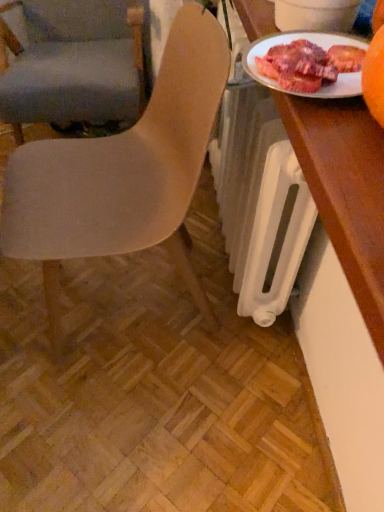
Describe the element at coordinates (123, 173) in the screenshot. I see `matte beige chair at center, which is the first chair in front-to-back order` at that location.

Locate an element on the screen. The width and height of the screenshot is (384, 512). matte beige chair at center, the 2th chair when ordered from back to front is located at coordinates (123, 173).

Describe the element at coordinates (313, 42) in the screenshot. This screenshot has height=512, width=384. I see `white glossy plate at upper right` at that location.

Where is `matte beige chair at center, the 2th chair when ordered from back to front`? The height and width of the screenshot is (512, 384). matte beige chair at center, the 2th chair when ordered from back to front is located at coordinates (123, 173).

Which of these two, matte gray chair at left, the second chair from the front, or wooden desk at right, is wider?

matte gray chair at left, the second chair from the front, is wider.

Is matte gray chair at left, marked as the first chair in a back-to-front arrangement, at the left side of wooden desk at right?

Yes.

The image size is (384, 512). What are the coordinates of `chair that is the 2nd one when counting leftward from the wooden desk at right` in the screenshot? It's located at pos(74,63).

Could you tell me if matte gray chair at left, marked as the first chair in a back-to-front arrangement, is facing wooden desk at right?

Yes, matte gray chair at left, marked as the first chair in a back-to-front arrangement, is turned towards wooden desk at right.

In order to click on chair below the matte gray chair at left, the second chair from the front (from the image's perspective) in this screenshot , I will do `click(123, 173)`.

Between matte gray chair at left, the second chair from the front, and matte beige chair at center, the 2th chair when ordered from back to front, which one has larger width?

matte gray chair at left, the second chair from the front, is wider.

Which of these two, matte gray chair at left, marked as the first chair in a back-to-front arrangement, or matte beige chair at center, which is the first chair in front-to-back order, stands taller?

matte beige chair at center, which is the first chair in front-to-back order.

From a real-world perspective, is matte gray chair at left, the second chair from the front, positioned under matte beige chair at center, the 2th chair when ordered from back to front, based on gravity?

Yes.

Is matte gray chair at left, the second chair from the front, completely or partially outside of white glossy plate at upper right?

matte gray chair at left, the second chair from the front, is positioned outside white glossy plate at upper right.

How different are the orientations of matte gray chair at left, the second chair from the front, and white glossy plate at upper right in degrees?

The angle between the facing direction of matte gray chair at left, the second chair from the front, and the facing direction of white glossy plate at upper right is 90.3 degrees.

Which is more distant, (141, 42) or (331, 87)?

Point (141, 42)

Is matte gray chair at left, the second chair from the front, facing away from white glossy plate at upper right?

No, matte gray chair at left, the second chair from the front, is not facing the opposite direction of white glossy plate at upper right.

Considering the positions of point (338, 93) and point (51, 55), is point (338, 93) closer or farther from the camera than point (51, 55)?

Point (338, 93) is closer to the camera than point (51, 55).

Who is bigger, white glossy plate at upper right or matte gray chair at left, the second chair from the front?

With larger size is matte gray chair at left, the second chair from the front.

Is the depth of white glossy plate at upper right less than that of matte gray chair at left, the second chair from the front?

Yes, the depth of white glossy plate at upper right is less than that of matte gray chair at left, the second chair from the front.

Is white glossy plate at upper right not within matte gray chair at left, the second chair from the front?

white glossy plate at upper right is positioned outside matte gray chair at left, the second chair from the front.

From a real-world perspective, is matte beige chair at center, the 2th chair when ordered from back to front, beneath wooden desk at right?

Yes, from a real-world perspective, matte beige chair at center, the 2th chair when ordered from back to front, is beneath wooden desk at right.

Does matte beige chair at center, the 2th chair when ordered from back to front, come in front of wooden desk at right?

No, the depth of matte beige chair at center, the 2th chair when ordered from back to front, is greater than that of wooden desk at right.

Who is bigger, matte beige chair at center, the 2th chair when ordered from back to front, or wooden desk at right?

Bigger between the two is matte beige chair at center, the 2th chair when ordered from back to front.

Is matte beige chair at center, the 2th chair when ordered from back to front, thinner than wooden desk at right?

Incorrect, the width of matte beige chair at center, the 2th chair when ordered from back to front, is not less than that of wooden desk at right.

Considering the sizes of objects wooden desk at right and white glossy plate at upper right in the image provided, who is bigger, wooden desk at right or white glossy plate at upper right?

With larger size is wooden desk at right.

Is wooden desk at right touching white glossy plate at upper right?

No, wooden desk at right is not in contact with white glossy plate at upper right.

Is wooden desk at right outside of white glossy plate at upper right?

wooden desk at right is positioned outside white glossy plate at upper right.

Is wooden desk at right thinner than white glossy plate at upper right?

No, wooden desk at right is not thinner than white glossy plate at upper right.

Is wooden desk at right wider or thinner than matte gray chair at left, marked as the first chair in a back-to-front arrangement?

Considering their sizes, wooden desk at right looks slimmer than matte gray chair at left, marked as the first chair in a back-to-front arrangement.

Does wooden desk at right have a lesser height compared to matte gray chair at left, marked as the first chair in a back-to-front arrangement?

Yes.

From the image's perspective, would you say wooden desk at right is shown under matte gray chair at left, the second chair from the front?

Yes, from the image's perspective, wooden desk at right is beneath matte gray chair at left, the second chair from the front.

Locate an element on the screen. This screenshot has height=512, width=384. desk that is below the matte gray chair at left, the second chair from the front (from the image's perspective) is located at coordinates (345, 192).

Where is `chair above the matte beige chair at center, the 2th chair when ordered from back to front (from the image's perspective)`? Image resolution: width=384 pixels, height=512 pixels. chair above the matte beige chair at center, the 2th chair when ordered from back to front (from the image's perspective) is located at coordinates (74, 63).

From the image, which object appears to be farther from white glossy plate at upper right, matte beige chair at center, which is the first chair in front-to-back order, or matte gray chair at left, marked as the first chair in a back-to-front arrangement?

Based on the image, matte gray chair at left, marked as the first chair in a back-to-front arrangement, appears to be further to white glossy plate at upper right.

Considering their positions, is white glossy plate at upper right positioned further to wooden desk at right than matte beige chair at center, the 2th chair when ordered from back to front?

matte beige chair at center, the 2th chair when ordered from back to front, lies further to wooden desk at right than the other object.

Consider the image. Which object lies nearer to the anchor point matte beige chair at center, the 2th chair when ordered from back to front, white glossy plate at upper right or wooden desk at right?

The object closer to matte beige chair at center, the 2th chair when ordered from back to front, is white glossy plate at upper right.

Looking at this image, looking at the image, which one is located further to matte gray chair at left, the second chair from the front, wooden desk at right or matte beige chair at center, the 2th chair when ordered from back to front?

wooden desk at right is positioned further to the anchor matte gray chair at left, the second chair from the front.

Which object lies nearer to the anchor point white glossy plate at upper right, matte gray chair at left, the second chair from the front, or wooden desk at right?

Among the two, wooden desk at right is located nearer to white glossy plate at upper right.

Based on their spatial positions, is matte gray chair at left, the second chair from the front, or matte beige chair at center, which is the first chair in front-to-back order, closer to wooden desk at right?

matte beige chair at center, which is the first chair in front-to-back order, lies closer to wooden desk at right than the other object.

When comparing their distances from white glossy plate at upper right, does matte beige chair at center, which is the first chair in front-to-back order, or wooden desk at right seem further?

Based on the image, matte beige chair at center, which is the first chair in front-to-back order, appears to be further to white glossy plate at upper right.

Which object lies nearer to the anchor point wooden desk at right, matte beige chair at center, which is the first chair in front-to-back order, or white glossy plate at upper right?

white glossy plate at upper right.

Image resolution: width=384 pixels, height=512 pixels. In order to click on tableware between matte beige chair at center, which is the first chair in front-to-back order, and wooden desk at right from left to right in this screenshot , I will do `click(313, 42)`.

Identify the location of chair positioned between wooden desk at right and matte gray chair at left, the second chair from the front, from near to far. The image size is (384, 512). (123, 173).

I want to click on tableware located between wooden desk at right and matte gray chair at left, the second chair from the front, in the depth direction, so click(313, 42).

Locate an element on the screen. Image resolution: width=384 pixels, height=512 pixels. chair positioned between white glossy plate at upper right and matte gray chair at left, the second chair from the front, from near to far is located at coordinates (123, 173).